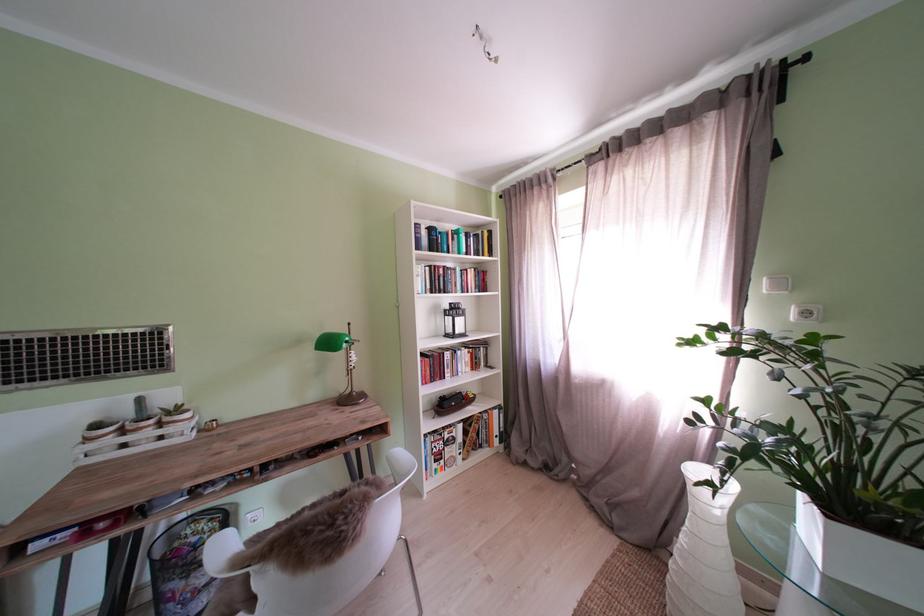
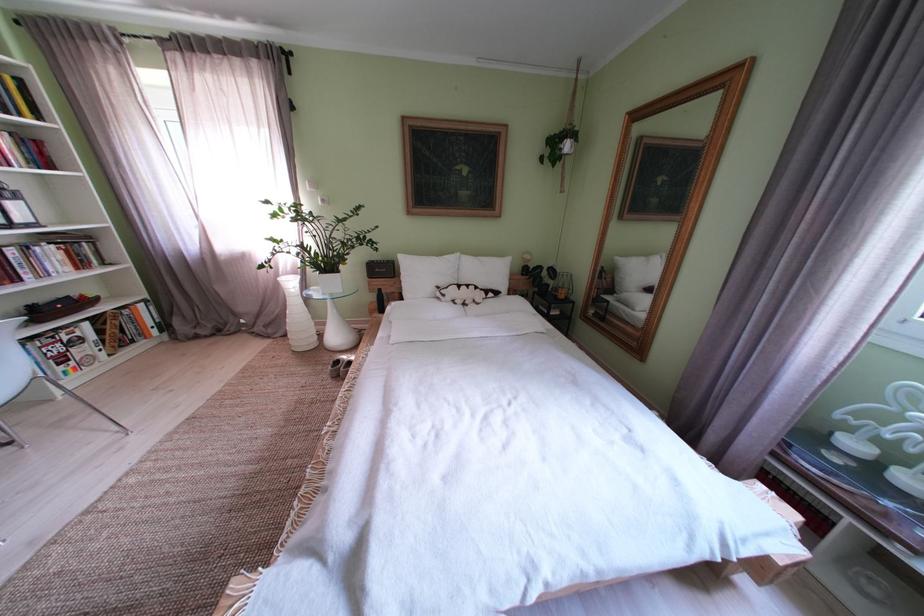
The point at (843, 517) is marked in the first image. Where is the corresponding point in the second image?

(333, 278)